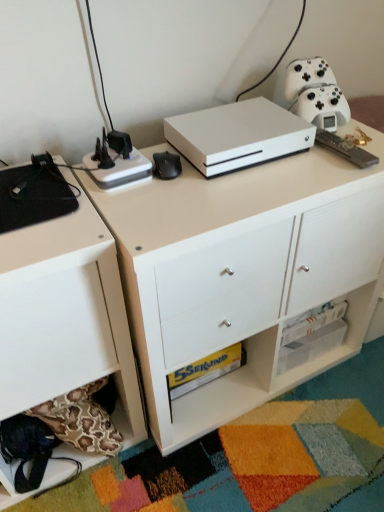
What do you see at coordinates (65, 316) in the screenshot? I see `white matte chest of drawers at lower left` at bounding box center [65, 316].

The image size is (384, 512). What do you see at coordinates (316, 94) in the screenshot? I see `white matte game controller at upper right, which ranks as the 1th appliance in right-to-left order` at bounding box center [316, 94].

In order to click on white matte xbox one s at center in this screenshot , I will do `click(245, 274)`.

Is point (48, 198) less distant than point (285, 182)?

Yes, it is.

Considering the relative sizes of black matte mouse pad at left, which is the 1th appliance in left-to-right order, and white matte xbox one s at center in the image provided, is black matte mouse pad at left, which is the 1th appliance in left-to-right order, shorter than white matte xbox one s at center?

Yes, black matte mouse pad at left, which is the 1th appliance in left-to-right order, is shorter than white matte xbox one s at center.

Looking at their sizes, would you say black matte mouse pad at left, which is the 1th appliance in left-to-right order, is wider or thinner than white matte xbox one s at center?

Clearly, black matte mouse pad at left, which is the 1th appliance in left-to-right order, has less width compared to white matte xbox one s at center.

How different are the orientations of black matte mouse pad at left, which is the 1th appliance in left-to-right order, and white matte xbox one s at center in degrees?

The angular difference between black matte mouse pad at left, which is the 1th appliance in left-to-right order, and white matte xbox one s at center is 0.184 degrees.

Is black plastic power strip at upper left, the second appliance when ordered from left to right, not inside white matte chest of drawers at lower left?

Yes, black plastic power strip at upper left, the second appliance when ordered from left to right, is located beyond the bounds of white matte chest of drawers at lower left.

From the image's perspective, is black plastic power strip at upper left, which is the 3th appliance from right to left, located above or below white matte chest of drawers at lower left?

Clearly, from the image's perspective, black plastic power strip at upper left, which is the 3th appliance from right to left, is above white matte chest of drawers at lower left.

The image size is (384, 512). Find the location of `the 2nd appliance behind the white matte chest of drawers at lower left`. the 2nd appliance behind the white matte chest of drawers at lower left is located at coordinates (116, 161).

Considering the sizes of black plastic power strip at upper left, the second appliance when ordered from left to right, and white matte chest of drawers at lower left in the image, is black plastic power strip at upper left, the second appliance when ordered from left to right, wider or thinner than white matte chest of drawers at lower left?

black plastic power strip at upper left, the second appliance when ordered from left to right, is thinner than white matte chest of drawers at lower left.

Is white matte chest of drawers at lower left not within black plastic power strip at upper left, which is the 3th appliance from right to left?

Yes, white matte chest of drawers at lower left is outside of black plastic power strip at upper left, which is the 3th appliance from right to left.

Considering the positions of objects white matte chest of drawers at lower left and black plastic power strip at upper left, which is the 3th appliance from right to left, in the image provided, who is more to the right, white matte chest of drawers at lower left or black plastic power strip at upper left, which is the 3th appliance from right to left,?

From the viewer's perspective, black plastic power strip at upper left, which is the 3th appliance from right to left, appears more on the right side.

Which appliance is the 2nd one when counting from the back of the white matte chest of drawers at lower left? Please provide its 2D coordinates.

[(116, 161)]

From a real-world perspective, who is located lower, white matte chest of drawers at lower left or black plastic power strip at upper left, the second appliance when ordered from left to right?

white matte chest of drawers at lower left, from a real-world perspective.

Which of these two, white matte xbox one s at center or black matte mouse pad at left, which is the 1th appliance in left-to-right order, is bigger?

Bigger between the two is white matte xbox one s at center.

From the image's perspective, which one is positioned lower, white matte xbox one s at center or black matte mouse pad at left, marked as the fourth appliance in a right-to-left arrangement?

white matte xbox one s at center.

Is point (353, 254) behind point (37, 206)?

Yes, point (353, 254) is farther from viewer.

Considering the relative positions of white matte xbox one s at center and black matte mouse pad at left, which is the 1th appliance in left-to-right order, in the image provided, is white matte xbox one s at center to the left or to the right of black matte mouse pad at left, which is the 1th appliance in left-to-right order,?

In the image, white matte xbox one s at center appears on the right side of black matte mouse pad at left, which is the 1th appliance in left-to-right order.

Which is more distant, (x=36, y=188) or (x=310, y=118)?

The point (x=310, y=118) is behind.

From the image's perspective, which one is positioned lower, black matte mouse pad at left, which is the 1th appliance in left-to-right order, or white matte game controller at upper right, which ranks as the 1th appliance in right-to-left order?

black matte mouse pad at left, which is the 1th appliance in left-to-right order, from the image's perspective.

Based on the photo, can you confirm if black matte mouse pad at left, marked as the fourth appliance in a right-to-left arrangement, is positioned to the left of white matte game controller at upper right, the fourth appliance from the left?

Correct, you'll find black matte mouse pad at left, marked as the fourth appliance in a right-to-left arrangement, to the left of white matte game controller at upper right, the fourth appliance from the left.

Does white matte game controller at upper right, which ranks as the 1th appliance in right-to-left order, have a lesser width compared to black matte mouse pad at left, marked as the fourth appliance in a right-to-left arrangement?

Yes.

How much distance is there between white matte game controller at upper right, the fourth appliance from the left, and black matte mouse pad at left, marked as the fourth appliance in a right-to-left arrangement?

white matte game controller at upper right, the fourth appliance from the left, is 26.60 inches away from black matte mouse pad at left, marked as the fourth appliance in a right-to-left arrangement.

Does point (321, 118) come farther from viewer compared to point (70, 187)?

Yes, point (321, 118) is farther from viewer.

From a real-world perspective, is white matte game controller at upper right, which ranks as the 1th appliance in right-to-left order, on top of black matte mouse pad at left, marked as the fourth appliance in a right-to-left arrangement?

Yes.

Is white matte xbox one s at center inside or outside of white matte gaming console at center, which is the 2th appliance in right-to-left order?

white matte xbox one s at center lies outside white matte gaming console at center, which is the 2th appliance in right-to-left order.

Between white matte xbox one s at center and white matte gaming console at center, which ranks as the 3th appliance in left-to-right order, which one is positioned in front?

white matte xbox one s at center is closer to the camera.

Is white matte xbox one s at center positioned with its back to white matte gaming console at center, which ranks as the 3th appliance in left-to-right order?

white matte xbox one s at center is not turned away from white matte gaming console at center, which ranks as the 3th appliance in left-to-right order.

How many degrees apart are the facing directions of white matte xbox one s at center and white matte gaming console at center, which is the 2th appliance in right-to-left order?

They differ by 0.184 degrees in their facing directions.

The image size is (384, 512). In order to click on desk on the right of black matte mouse pad at left, marked as the fourth appliance in a right-to-left arrangement in this screenshot , I will do `click(245, 274)`.

This screenshot has height=512, width=384. I want to click on the 2nd appliance positioned above the white matte chest of drawers at lower left (from a real-world perspective), so click(x=116, y=161).

Estimate the real-world distances between objects in this image. Which object is closer to white matte gaming console at center, which is the 2th appliance in right-to-left order, white matte game controller at upper right, which ranks as the 1th appliance in right-to-left order, or white matte xbox one s at center?

white matte game controller at upper right, which ranks as the 1th appliance in right-to-left order.

Based on the photo, looking at the image, which one is located further to black plastic power strip at upper left, which is the 3th appliance from right to left, white matte gaming console at center, which ranks as the 3th appliance in left-to-right order, or white matte chest of drawers at lower left?

Based on the image, white matte chest of drawers at lower left appears to be further to black plastic power strip at upper left, which is the 3th appliance from right to left.

From the image, which object appears to be nearer to white matte gaming console at center, which ranks as the 3th appliance in left-to-right order, black plastic power strip at upper left, which is the 3th appliance from right to left, or white matte xbox one s at center?

black plastic power strip at upper left, which is the 3th appliance from right to left, is closer to white matte gaming console at center, which ranks as the 3th appliance in left-to-right order.

Looking at the image, which one is located closer to white matte gaming console at center, which is the 2th appliance in right-to-left order, black matte mouse pad at left, which is the 1th appliance in left-to-right order, or white matte game controller at upper right, which ranks as the 1th appliance in right-to-left order?

Among the two, white matte game controller at upper right, which ranks as the 1th appliance in right-to-left order, is located nearer to white matte gaming console at center, which is the 2th appliance in right-to-left order.

Looking at the image, which one is located closer to black plastic power strip at upper left, which is the 3th appliance from right to left, white matte game controller at upper right, which ranks as the 1th appliance in right-to-left order, or black matte mouse pad at left, marked as the fourth appliance in a right-to-left arrangement?

Based on the image, black matte mouse pad at left, marked as the fourth appliance in a right-to-left arrangement, appears to be nearer to black plastic power strip at upper left, which is the 3th appliance from right to left.

From the image, which object appears to be farther from white matte chest of drawers at lower left, black plastic power strip at upper left, which is the 3th appliance from right to left, or black matte mouse pad at left, marked as the fourth appliance in a right-to-left arrangement?

black plastic power strip at upper left, which is the 3th appliance from right to left, is positioned further to the anchor white matte chest of drawers at lower left.

When comparing their distances from black matte mouse pad at left, which is the 1th appliance in left-to-right order, does white matte gaming console at center, which is the 2th appliance in right-to-left order, or white matte game controller at upper right, which ranks as the 1th appliance in right-to-left order, seem closer?

white matte gaming console at center, which is the 2th appliance in right-to-left order, is closer to black matte mouse pad at left, which is the 1th appliance in left-to-right order.

Which object lies nearer to the anchor point white matte gaming console at center, which ranks as the 3th appliance in left-to-right order, black plastic power strip at upper left, which is the 3th appliance from right to left, or black matte mouse pad at left, which is the 1th appliance in left-to-right order?

black plastic power strip at upper left, which is the 3th appliance from right to left.

Where is `desk between white matte chest of drawers at lower left and white matte game controller at upper right, which ranks as the 1th appliance in right-to-left order, from left to right`? The image size is (384, 512). desk between white matte chest of drawers at lower left and white matte game controller at upper right, which ranks as the 1th appliance in right-to-left order, from left to right is located at coordinates (245, 274).

The width and height of the screenshot is (384, 512). In order to click on desk located between black matte mouse pad at left, marked as the fourth appliance in a right-to-left arrangement, and white matte game controller at upper right, which ranks as the 1th appliance in right-to-left order, in the left-right direction in this screenshot , I will do `click(245, 274)`.

Locate an element on the screen. This screenshot has height=512, width=384. chest of drawers between black matte mouse pad at left, which is the 1th appliance in left-to-right order, and white matte gaming console at center, which ranks as the 3th appliance in left-to-right order is located at coordinates (65, 316).

Locate an element on the screen. The width and height of the screenshot is (384, 512). chest of drawers between black matte mouse pad at left, marked as the fourth appliance in a right-to-left arrangement, and white matte xbox one s at center, in the horizontal direction is located at coordinates 65,316.